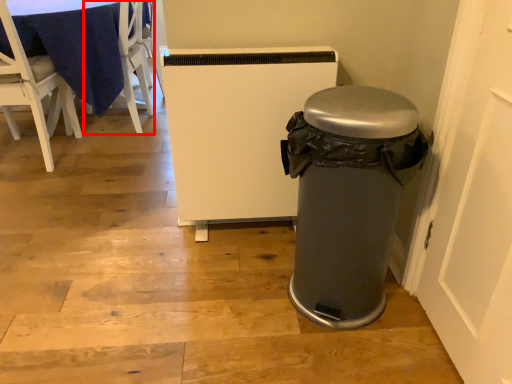
Question: From the image's perspective, what is the correct spatial relationship of chair (annotated by the red box) in relation to chair?

Choices:
 (A) above
 (B) below

Answer: (A)